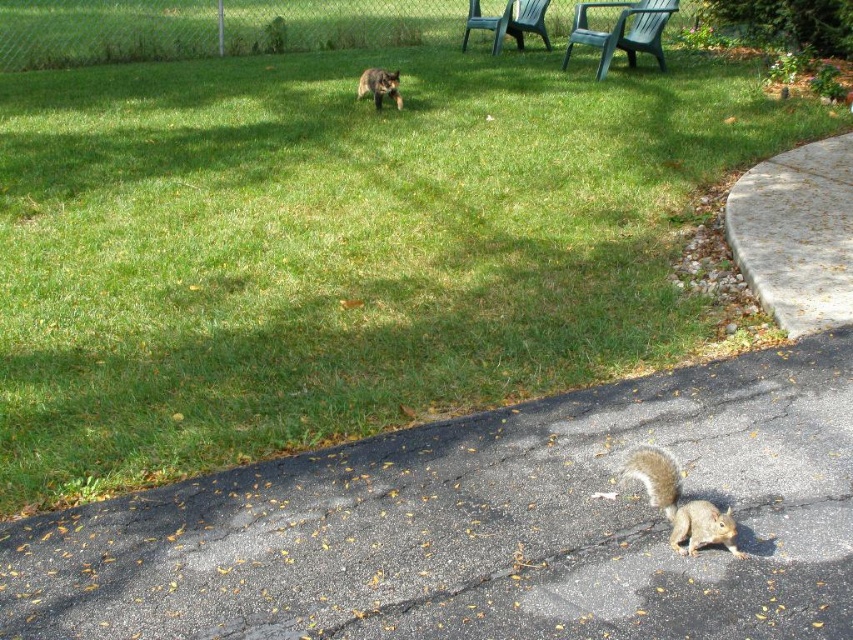
Question: Can you confirm if gray furry squirrel at lower right is thinner than gray furry tail at lower center?

Choices:
 (A) no
 (B) yes

Answer: (A)

Question: In this image, where is gray furry squirrel at lower right located relative to green plastic chair at upper right?

Choices:
 (A) below
 (B) above

Answer: (A)

Question: Which of these objects is positioned farthest from the gray furry tail at lower center?

Choices:
 (A) green plastic chair at upper right
 (B) gray asphalt at lower right

Answer: (A)

Question: Which of the following is the closest to the observer?

Choices:
 (A) green plastic chair at upper right
 (B) gray furry tail at lower center
 (C) fuzzy brown squirrel at upper center

Answer: (B)

Question: Considering the relative positions of gray asphalt at lower right and gray furry tail at lower center in the image provided, where is gray asphalt at lower right located with respect to gray furry tail at lower center?

Choices:
 (A) left
 (B) right

Answer: (A)

Question: Among these points, which one is farthest from the camera?

Choices:
 (A) (656, 465)
 (B) (682, 547)
 (C) (618, 17)
 (D) (465, 28)

Answer: (C)